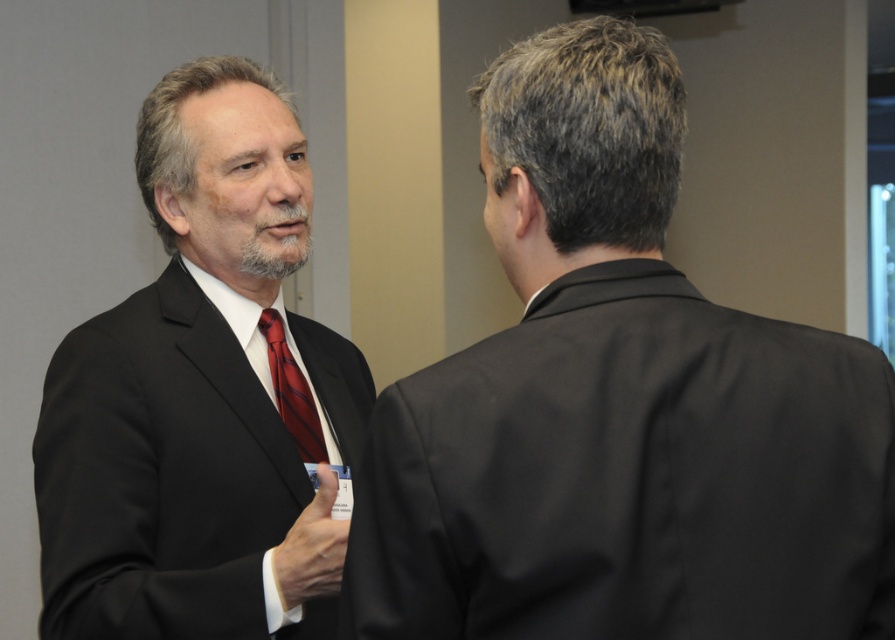
Is point (625, 417) in front of point (297, 365)?

Yes, it is.

Can you confirm if matte black suit at center is positioned to the right of shiny silk tie at left?

Correct, you'll find matte black suit at center to the right of shiny silk tie at left.

Between point (720, 589) and point (274, 365), which one is positioned behind?

The point (274, 365) is behind.

This screenshot has width=895, height=640. What are the coordinates of `matte black suit at center` in the screenshot? It's located at (619, 406).

Between matte black suit at center and matte black suit at left, which one has more height?

Standing taller between the two is matte black suit at left.

Can you confirm if matte black suit at center is positioned to the left of matte black suit at left?

No, matte black suit at center is not to the left of matte black suit at left.

The width and height of the screenshot is (895, 640). What do you see at coordinates (619, 406) in the screenshot?
I see `matte black suit at center` at bounding box center [619, 406].

The height and width of the screenshot is (640, 895). I want to click on matte black suit at center, so click(619, 406).

Can you confirm if matte black suit at left is taller than shiny silk tie at left?

Yes, matte black suit at left is taller than shiny silk tie at left.

Is matte black suit at left smaller than shiny silk tie at left?

No, matte black suit at left is not smaller than shiny silk tie at left.

I want to click on matte black suit at left, so click(x=202, y=396).

The width and height of the screenshot is (895, 640). Find the location of `matte black suit at left`. matte black suit at left is located at coordinates (202, 396).